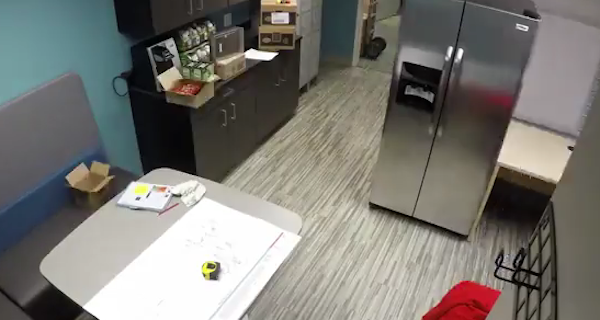
I want to click on gray seat cushion, so click(x=24, y=272), click(x=73, y=217), click(x=14, y=309).